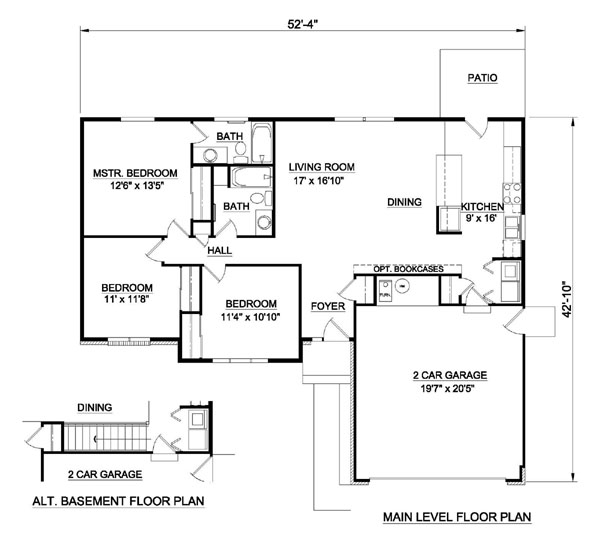
The width and height of the screenshot is (600, 544). I want to click on living room, so click(327, 145).